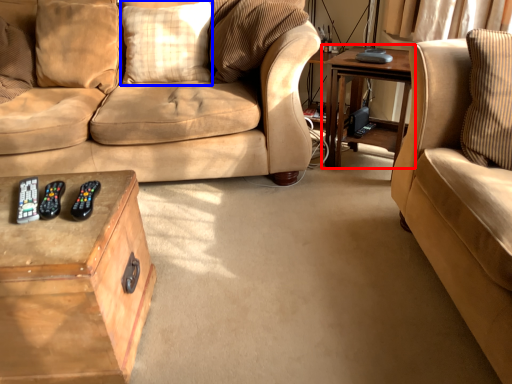
Question: Which object is further to the camera taking this photo, table (highlighted by a red box) or pillow (highlighted by a blue box)?

Choices:
 (A) table
 (B) pillow

Answer: (B)